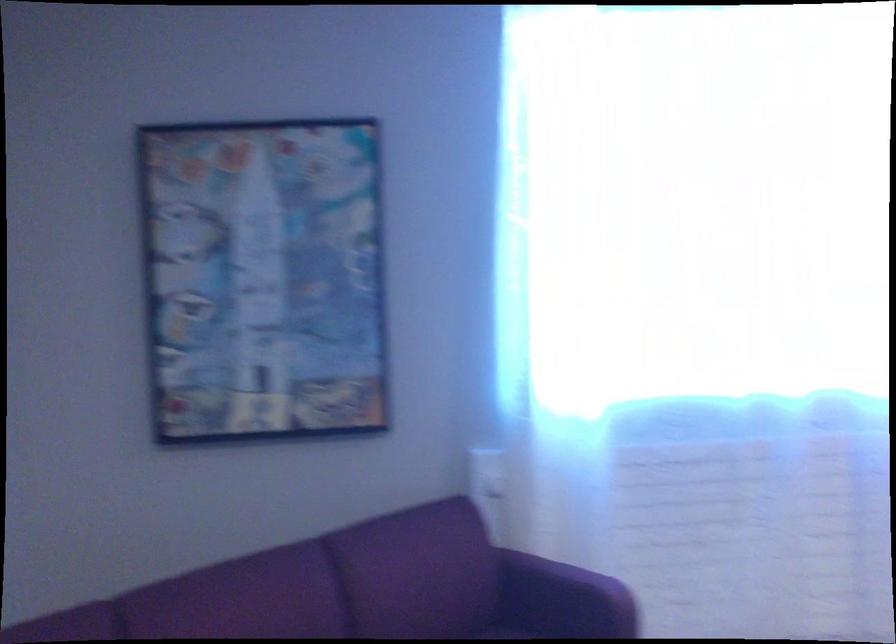
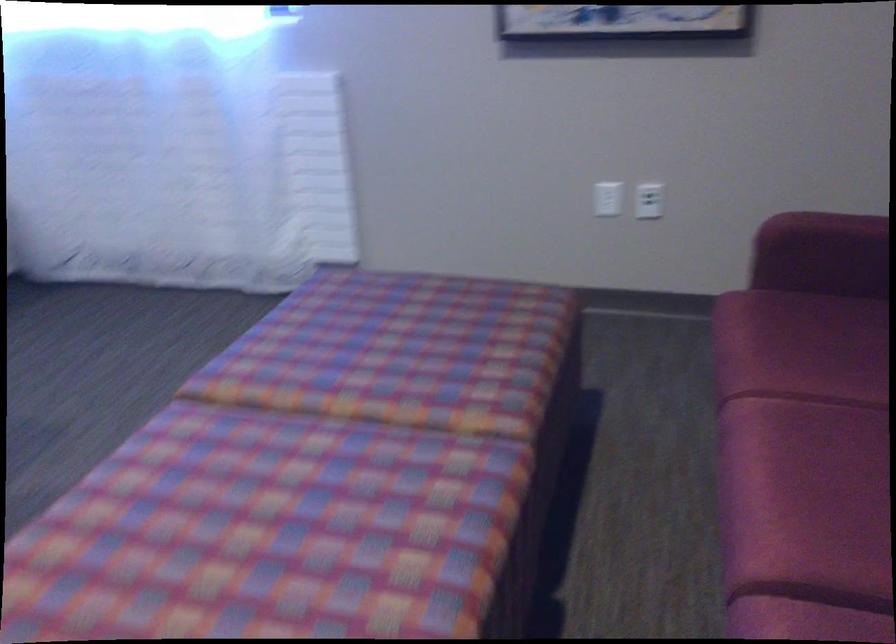
Question: The images are taken continuously from a first-person perspective. In which direction are you moving?

Choices:
 (A) Left
 (B) Right
 (C) Forward
 (D) Backward

Answer: (B)